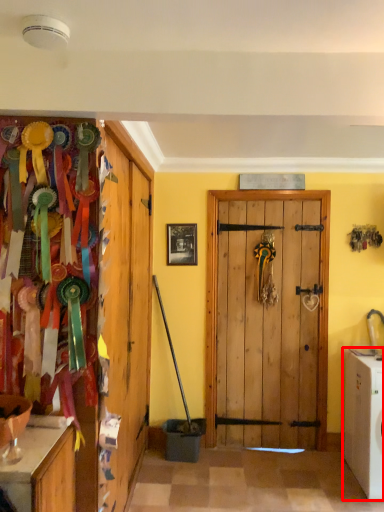
Question: From the image's perspective, what is the correct spatial positioning of washing machine (annotated by the red box) in reference to picture frame?

Choices:
 (A) below
 (B) above

Answer: (A)